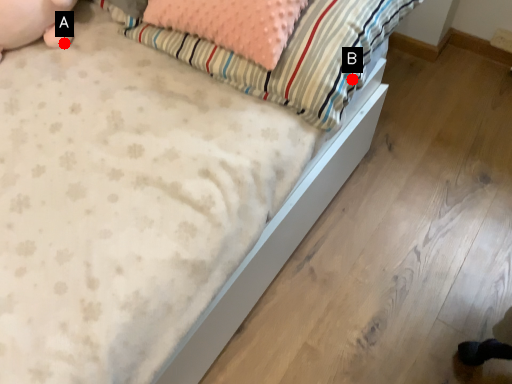
Question: Two points are circled on the image, labeled by A and B beside each circle. Among these points, which one is farthest from the camera?

Choices:
 (A) A is further
 (B) B is further

Answer: (A)